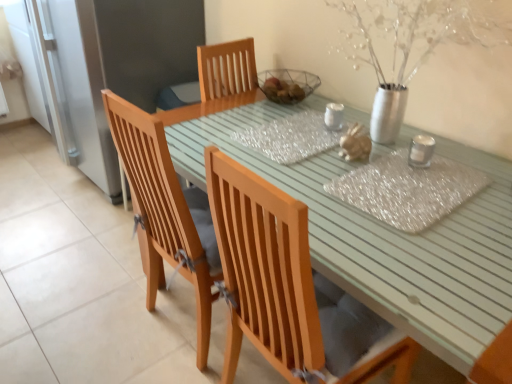
Identify the location of free space to the left of clear plastic placemat at center. (320, 187).